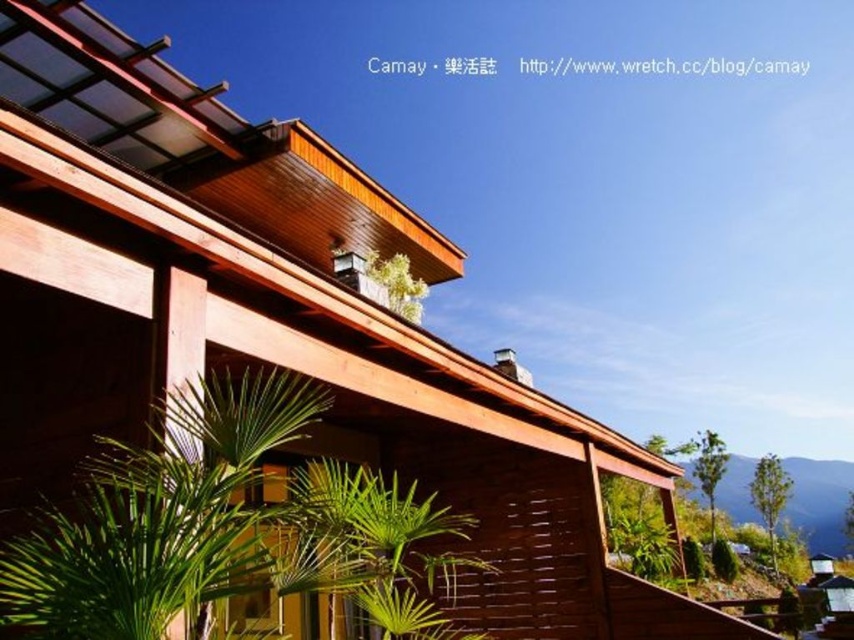
Does green leafy plant at lower left have a lesser height compared to green leafy plant at lower right?

Yes.

Is green leafy plant at lower left thinner than green leafy plant at lower right?

No.

Is point (268, 436) behind point (732, 568)?

No, (268, 436) is in front of (732, 568).

You are a GUI agent. You are given a task and a screenshot of the screen. Output one action in this format:
    pyautogui.click(x=<x>, y=<y>)
    Task: Click on the green leafy plant at lower left
    
    Given the screenshot: What is the action you would take?
    pyautogui.click(x=225, y=525)

Can you confirm if green matte plant at upper center is positioned below green leafy plant at lower right?

Incorrect, green matte plant at upper center is not positioned below green leafy plant at lower right.

Can you confirm if green matte plant at upper center is positioned to the left of green leafy plant at lower right?

Indeed, green matte plant at upper center is positioned on the left side of green leafy plant at lower right.

Is point (385, 300) closer to viewer compared to point (721, 579)?

Yes, point (385, 300) is in front of point (721, 579).

Find the location of `green matte plant at upper center`. green matte plant at upper center is located at coordinates (396, 284).

Between green leafy plant at lower left and green matte plant at upper center, which one has more height?

green leafy plant at lower left is taller.

Is green leafy plant at lower left above green matte plant at upper center?

Actually, green leafy plant at lower left is below green matte plant at upper center.

Between point (363, 563) and point (382, 260), which one is positioned behind?

Point (382, 260)

Identify the location of green leafy plant at lower left. The width and height of the screenshot is (854, 640). (225, 525).